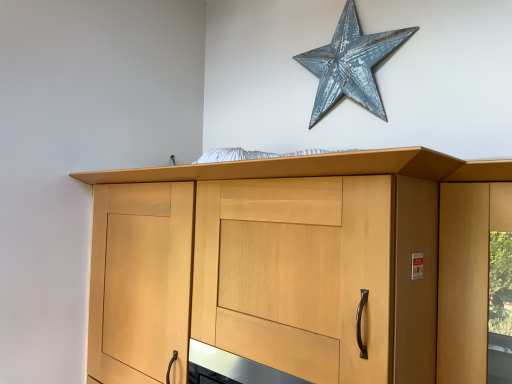
The width and height of the screenshot is (512, 384). Find the location of `light wood/texture cupboard at center`. light wood/texture cupboard at center is located at coordinates [x=297, y=266].

This screenshot has height=384, width=512. Describe the element at coordinates (297, 266) in the screenshot. I see `light wood/texture cupboard at center` at that location.

In order to face light wood/texture cupboard at center, should I rotate leftwards or rightwards?

You should rotate left by 0.261 degrees.

The width and height of the screenshot is (512, 384). What do you see at coordinates (350, 64) in the screenshot? I see `rusty metal star at upper center` at bounding box center [350, 64].

This screenshot has height=384, width=512. Find the location of `rusty metal star at upper center`. rusty metal star at upper center is located at coordinates (350, 64).

Identify the location of light wood/texture cupboard at center. (297, 266).

Which is more to the left, rusty metal star at upper center or light wood/texture cupboard at center?

From the viewer's perspective, light wood/texture cupboard at center appears more on the left side.

Is rusty metal star at upper center closer to camera compared to light wood/texture cupboard at center?

No.

Does point (329, 108) lie behind point (412, 293)?

Yes, point (329, 108) is farther from viewer.

From the image's perspective, is rusty metal star at upper center above or below light wood/texture cupboard at center?

rusty metal star at upper center is above light wood/texture cupboard at center.

From a real-world perspective, is rusty metal star at upper center positioned above or below light wood/texture cupboard at center?

rusty metal star at upper center is above light wood/texture cupboard at center.

In terms of width, does rusty metal star at upper center look wider or thinner when compared to light wood/texture cupboard at center?

rusty metal star at upper center is thinner than light wood/texture cupboard at center.

Who is shorter, rusty metal star at upper center or light wood/texture cupboard at center?

Standing shorter between the two is rusty metal star at upper center.

Can you confirm if rusty metal star at upper center is bigger than light wood/texture cupboard at center?

Incorrect, rusty metal star at upper center is not larger than light wood/texture cupboard at center.

Choose the correct answer: Is rusty metal star at upper center inside light wood/texture cupboard at center or outside it?

rusty metal star at upper center is not enclosed by light wood/texture cupboard at center.

Is rusty metal star at upper center beside light wood/texture cupboard at center?

No, rusty metal star at upper center is not touching light wood/texture cupboard at center.

Looking at this image, could you tell me if rusty metal star at upper center is facing light wood/texture cupboard at center?

No.

In the scene shown: Measure the distance from rusty metal star at upper center to light wood/texture cupboard at center.

rusty metal star at upper center is 29.23 inches from light wood/texture cupboard at center.

This screenshot has width=512, height=384. There is a light wood/texture cupboard at center. Find the location of `star above it (from a real-world perspective)`. star above it (from a real-world perspective) is located at coordinates (350, 64).

Which object is positioned more to the right, light wood/texture cupboard at center or rusty metal star at upper center?

rusty metal star at upper center.

Is light wood/texture cupboard at center in front of rusty metal star at upper center?

Yes, light wood/texture cupboard at center is in front of rusty metal star at upper center.

Considering the positions of points (418, 348) and (333, 101), is point (418, 348) closer to camera compared to point (333, 101)?

Yes, point (418, 348) is closer to viewer.

From the image's perspective, who appears lower, light wood/texture cupboard at center or rusty metal star at upper center?

light wood/texture cupboard at center appears lower in the image.

From a real-world perspective, is light wood/texture cupboard at center above or below rusty metal star at upper center?

Clearly, from a real-world perspective, light wood/texture cupboard at center is below rusty metal star at upper center.

Between light wood/texture cupboard at center and rusty metal star at upper center, which one has smaller width?

rusty metal star at upper center.

Can you confirm if light wood/texture cupboard at center is shorter than rusty metal star at upper center?

No.

Which of these two, light wood/texture cupboard at center or rusty metal star at upper center, is smaller?

With smaller size is rusty metal star at upper center.

Is light wood/texture cupboard at center inside or outside of rusty metal star at upper center?

light wood/texture cupboard at center lies outside rusty metal star at upper center.

Based on the photo, is light wood/texture cupboard at center directly adjacent to rusty metal star at upper center?

They are not placed beside each other.

Consider the image. Is light wood/texture cupboard at center oriented away from rusty metal star at upper center?

No, light wood/texture cupboard at center is not facing the opposite direction of rusty metal star at upper center.

The height and width of the screenshot is (384, 512). In the image, there is a light wood/texture cupboard at center. In order to click on star above it (from the image's perspective) in this screenshot , I will do `click(350, 64)`.

This screenshot has height=384, width=512. In order to click on cupboard below the rusty metal star at upper center (from a real-world perspective) in this screenshot , I will do `click(297, 266)`.

Find the location of a particular element. star to the right of light wood/texture cupboard at center is located at coordinates (350, 64).